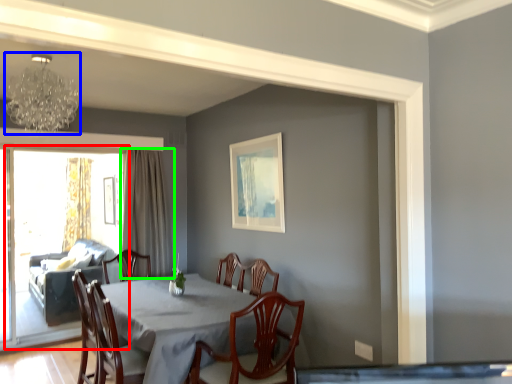
Question: Which object is positioned closest to screen door (highlighted by a red box)? Select from lamp (highlighted by a blue box) and curtain (highlighted by a green box).

Choices:
 (A) lamp
 (B) curtain

Answer: (B)